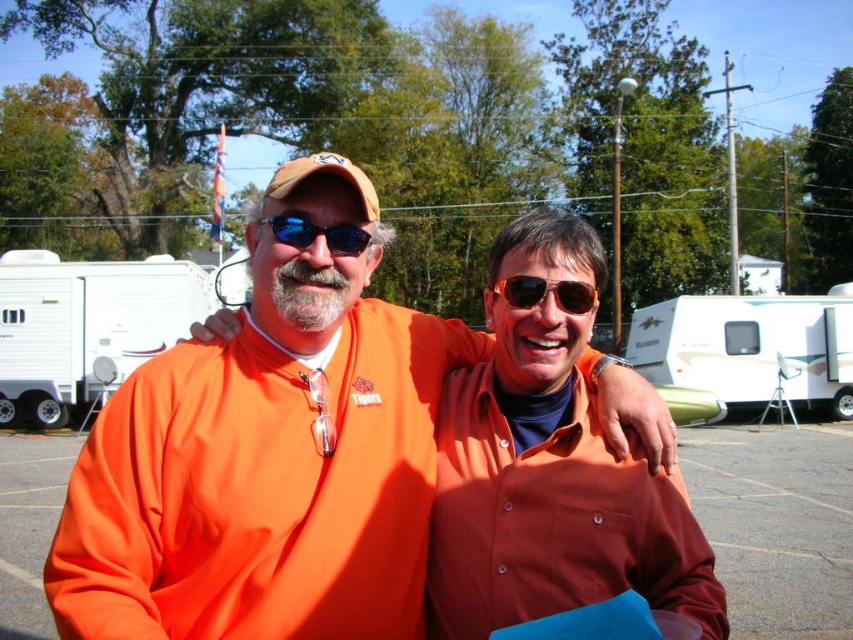
Is point (813, 304) less distant than point (346, 228)?

No, (813, 304) is further to viewer.

Is point (701, 376) positioned behind point (299, 248)?

Yes, it is.

Image resolution: width=853 pixels, height=640 pixels. Identify the location of white glossy trailer at right. (750, 348).

Is white plastic trailer at left smaller than blue reflective sunglasses at center?

Actually, white plastic trailer at left might be larger than blue reflective sunglasses at center.

Looking at this image, does white plastic trailer at left appear over blue reflective sunglasses at center?

Incorrect, white plastic trailer at left is not positioned above blue reflective sunglasses at center.

Does point (39, 301) come in front of point (334, 237)?

No, (39, 301) is behind (334, 237).

In order to click on white plastic trailer at left in this screenshot , I will do `click(86, 326)`.

Between white plastic trailer at left and gold reflective sunglasses at center, which one is positioned higher?

white plastic trailer at left is higher up.

Does white plastic trailer at left have a lesser height compared to gold reflective sunglasses at center?

In fact, white plastic trailer at left may be taller than gold reflective sunglasses at center.

Identify the location of white plastic trailer at left. The image size is (853, 640). (86, 326).